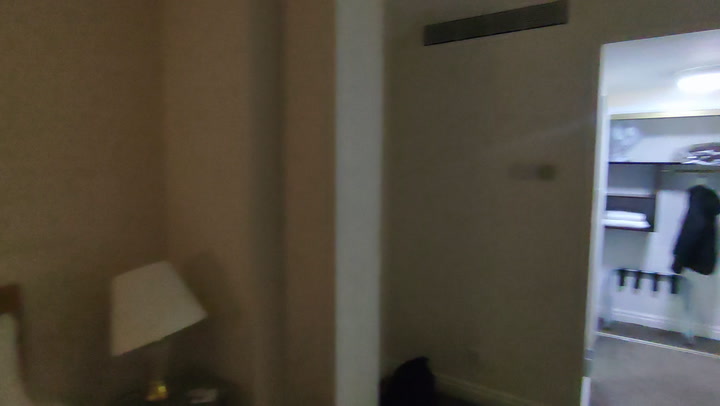
Identify the location of light. (705, 83).